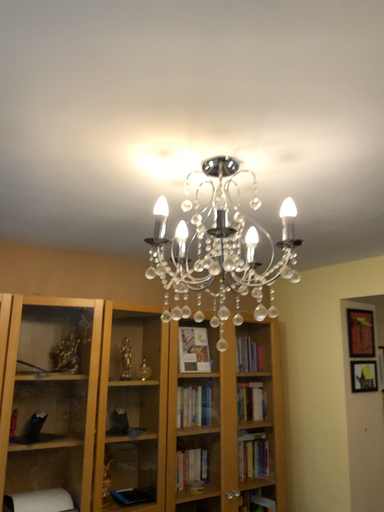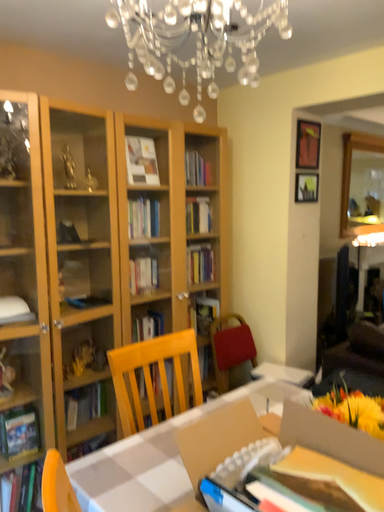
Question: Which way did the camera rotate in the video?

Choices:
 (A) rotated right
 (B) rotated left

Answer: (A)